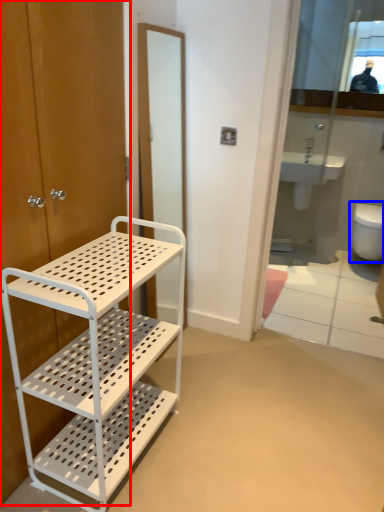
Question: Among these objects, which one is nearest to the camera, door (highlighted by a red box) or toilet (highlighted by a blue box)?

Choices:
 (A) door
 (B) toilet

Answer: (A)